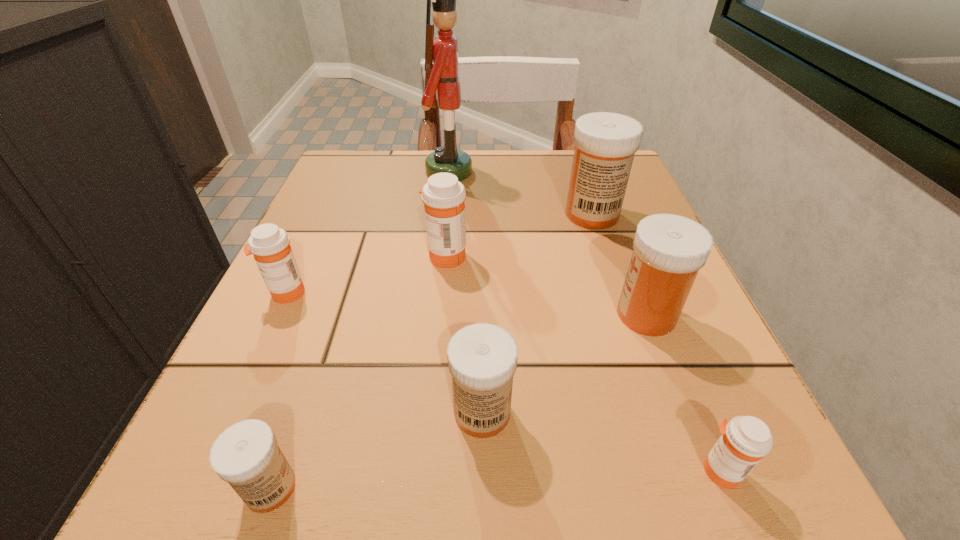
Image resolution: width=960 pixels, height=540 pixels. In the image, there is a desktop. Find the location of `free space at the left edge`. free space at the left edge is located at coordinates (251, 375).

Identify the location of free space at the right edge of the desktop. click(671, 392).

Locate an element on the screen. Image resolution: width=960 pixels, height=540 pixels. blank space at the near left corner of the desktop is located at coordinates (216, 522).

This screenshot has width=960, height=540. Find the location of `free location at the near right corner of the desktop`. free location at the near right corner of the desktop is located at coordinates (759, 474).

Find the location of `free area in between the biggest white medicine and the third nearest white medicine`. free area in between the biggest white medicine and the third nearest white medicine is located at coordinates (619, 265).

This screenshot has width=960, height=540. Find the location of `vacant space that's between the tallest object and the rightmost orange medicine`. vacant space that's between the tallest object and the rightmost orange medicine is located at coordinates [x=585, y=321].

This screenshot has height=540, width=960. I want to click on empty space between the sixth nearest object and the third nearest white medicine, so click(546, 285).

At what (x,y) coordinates should I click in order to perform the action: click on free space between the second orange medicine from left to right and the rightmost orange medicine. Please return your answer as a coordinate pair (x, y). The width and height of the screenshot is (960, 540). Looking at the image, I should click on click(x=583, y=363).

What are the coordinates of `free space between the smallest orange medicine and the nutcracker` in the screenshot? It's located at (585, 321).

At what (x,y) coordinates should I click in order to perform the action: click on vacant area that lies between the second white medicine from left to right and the green nutcracker. Please return your answer as a coordinate pair (x, y). The height and width of the screenshot is (540, 960). Looking at the image, I should click on (466, 292).